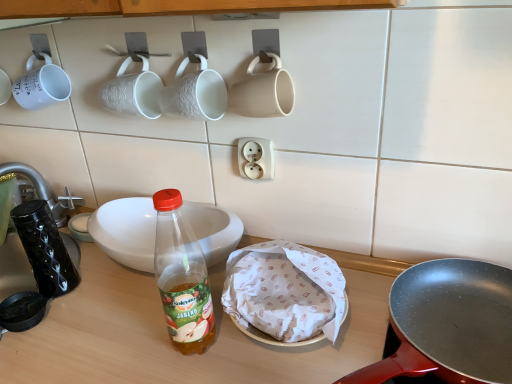
The width and height of the screenshot is (512, 384). Find the location of `free space that is in between translucent plastic bottle at center and black glossy coffee cup at left`. free space that is in between translucent plastic bottle at center and black glossy coffee cup at left is located at coordinates (117, 313).